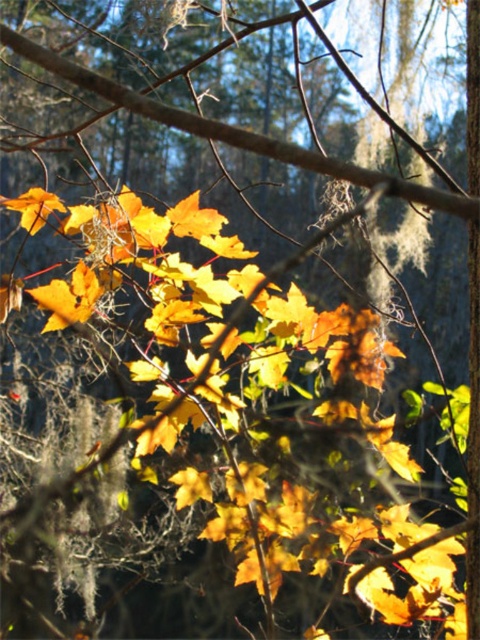
Question: Does brown matte branch at center have a larger size compared to matte yellow maple leaf at center?

Choices:
 (A) no
 (B) yes

Answer: (B)

Question: Which object appears closest to the camera in this image?

Choices:
 (A) brown matte branch at center
 (B) golden matte maple leaf at upper left
 (C) matte yellow maple leaf at center

Answer: (A)

Question: Is brown matte branch at center wider than golden matte maple leaf at upper left?

Choices:
 (A) yes
 (B) no

Answer: (A)

Question: Is brown matte branch at center positioned behind golden matte maple leaf at center?

Choices:
 (A) no
 (B) yes

Answer: (A)

Question: Based on their relative distances, which object is farther from the brown matte branch at center?

Choices:
 (A) golden matte maple leaf at center
 (B) golden matte maple leaf at upper left

Answer: (B)

Question: Which point is closer to the camera taking this photo?

Choices:
 (A) (64, 291)
 (B) (189, 200)
 (C) (257, 154)
 (D) (26, 211)

Answer: (C)